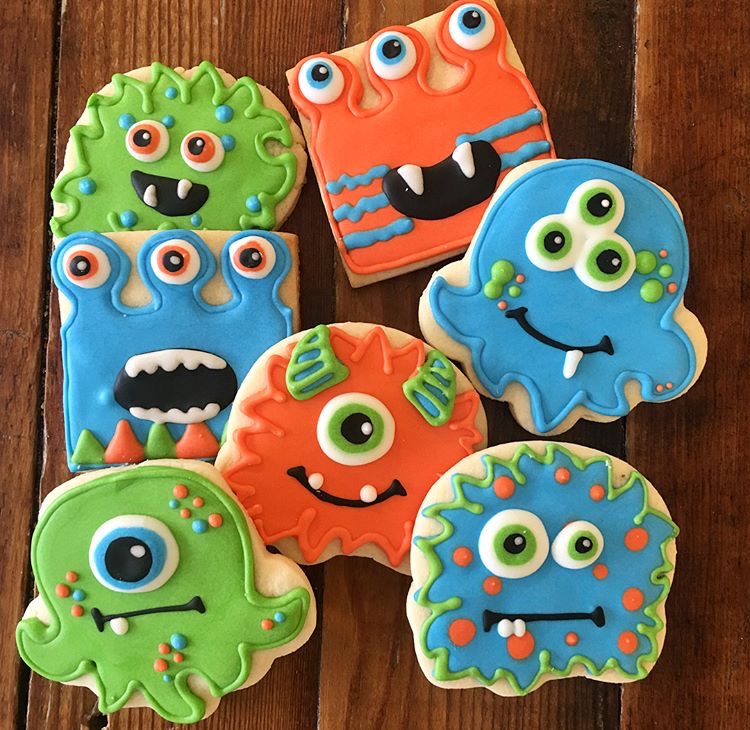
Identify the location of table surface. This screenshot has height=730, width=750. (175, 17).